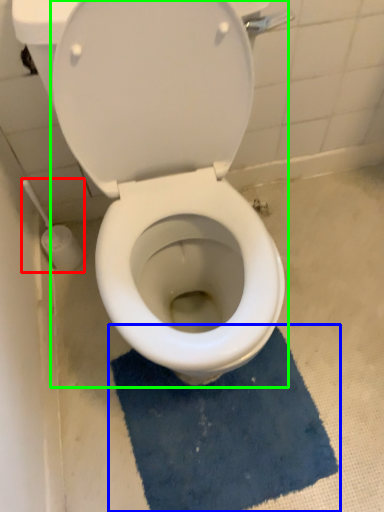
Question: Considering the real-world distances, which object is closest to brush (highlighted by a red box)? bath mat (highlighted by a blue box) or toilet (highlighted by a green box).

Choices:
 (A) bath mat
 (B) toilet

Answer: (B)